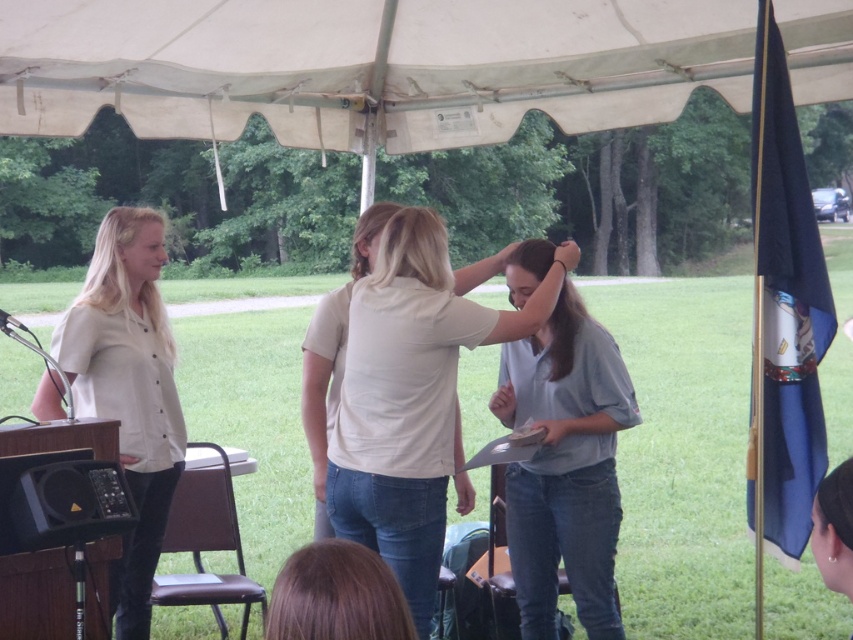
Question: In this image, where is white matte shirt at center located relative to matte black speaker at lower left?

Choices:
 (A) below
 (B) above

Answer: (B)

Question: Is white matte shirt at center closer to the viewer compared to matte black speaker at lower left?

Choices:
 (A) yes
 (B) no

Answer: (B)

Question: Which point is closer to the camera taking this photo?

Choices:
 (A) (619, 372)
 (B) (822, 22)
 (C) (103, 492)
 (D) (416, 580)

Answer: (C)

Question: Based on their relative distances, which object is farther from the light blue denim shirt at center?

Choices:
 (A) matte white blouse at left
 (B) white fabric canopy at upper center

Answer: (B)

Question: Is white matte shirt at center wider than light blue denim shirt at center?

Choices:
 (A) no
 (B) yes

Answer: (B)

Question: Which point is closer to the camera?

Choices:
 (A) white matte shirt at center
 (B) matte white blouse at left
 (C) matte black speaker at lower left
 (D) light blue denim shirt at center

Answer: (C)